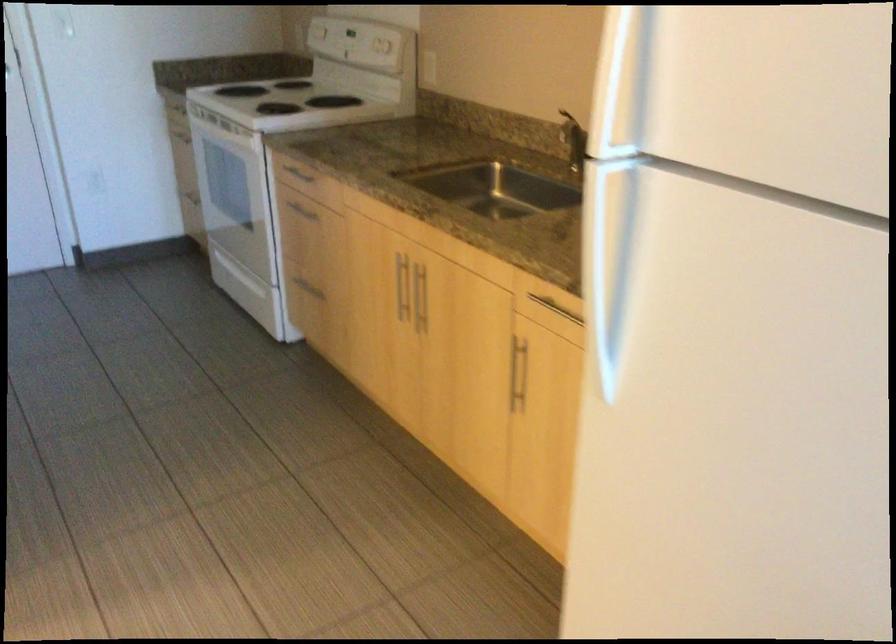
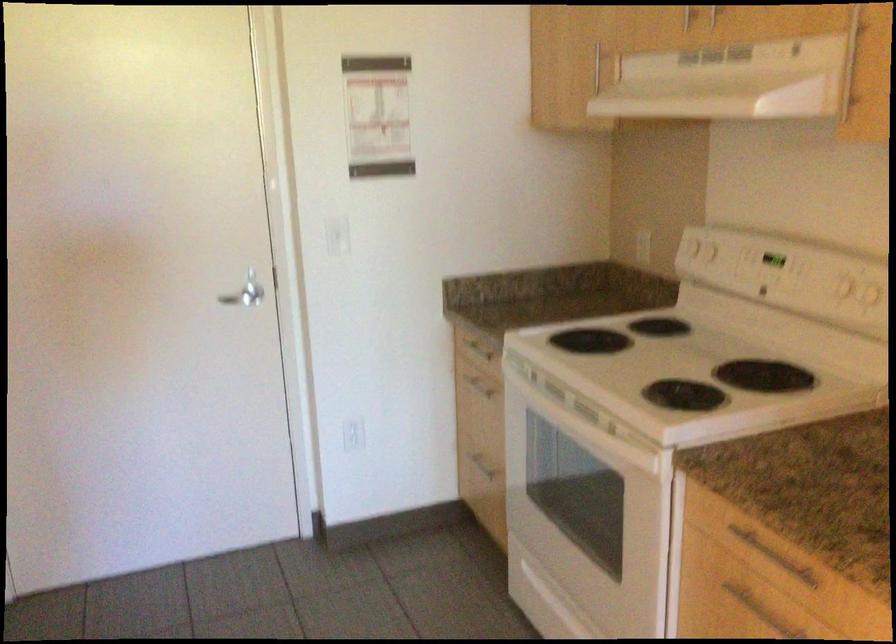
Find the pixel in the second image that matches point 190,144 in the first image.

(479, 384)